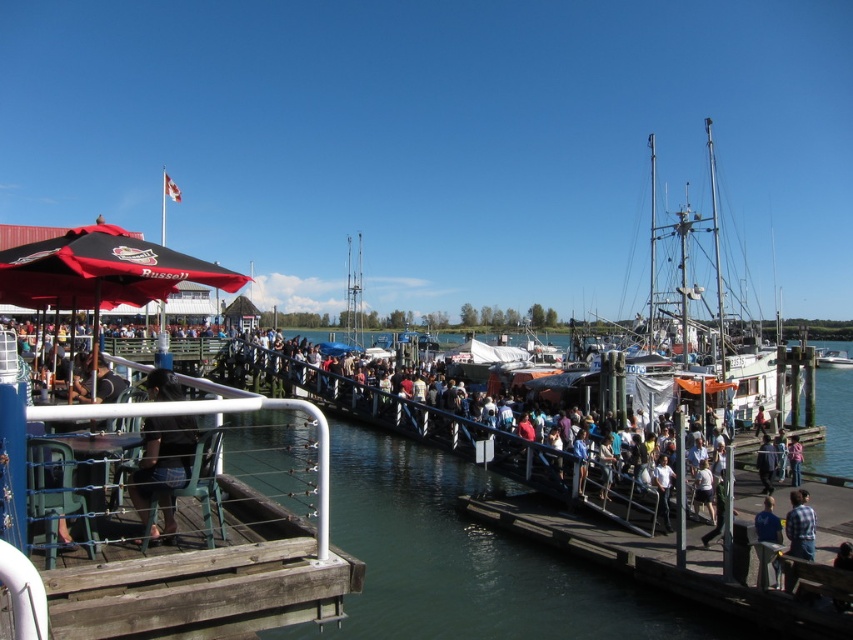
You are standing on the wooden pier and want to locate the white wooden boat at right. According to the coordinates provided, where should you look relative to your position?

The white wooden boat at right is located at coordinates point (654, 260), which means it is positioned to the right and slightly below your current position on the pier.

You are a photographer trying to capture a candid shot of both the plaid shirt at lower right and the blue fabric shirt at center without moving your camera position. Which shirt will appear wider in the photo?

The blue fabric shirt at center will appear wider in the photo since it has a greater width compared to the plaid shirt at lower right.